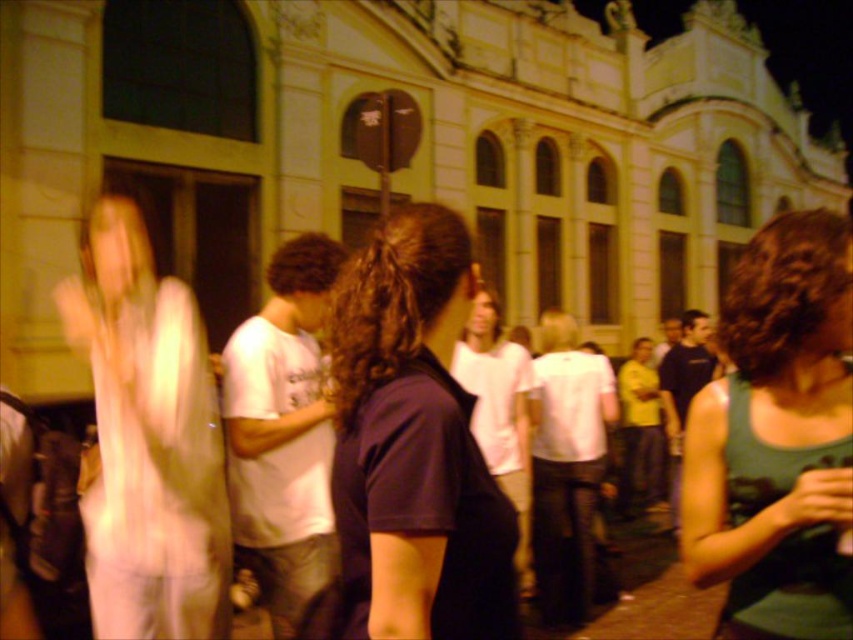
Question: Which point is closer to the camera taking this photo?

Choices:
 (A) (302, 257)
 (B) (692, 369)
 (C) (508, 340)

Answer: (A)

Question: Does white matte shirt at center have a smaller size compared to dark blue t-shirt at center?

Choices:
 (A) no
 (B) yes

Answer: (B)

Question: Where is dark blue shirt at center located in relation to white t-shirt at center in the image?

Choices:
 (A) left
 (B) right

Answer: (A)

Question: Which point is farther to the camera?

Choices:
 (A) light beige fabric dress at left
 (B) green fabric tank top at center
 (C) dark blue shirt at center

Answer: (A)

Question: Among these objects, which one is nearest to the camera?

Choices:
 (A) white matte shirt at center
 (B) green fabric tank top at center

Answer: (B)

Question: Does light beige fabric dress at left appear over white cotton t-shirt at center?

Choices:
 (A) no
 (B) yes

Answer: (A)